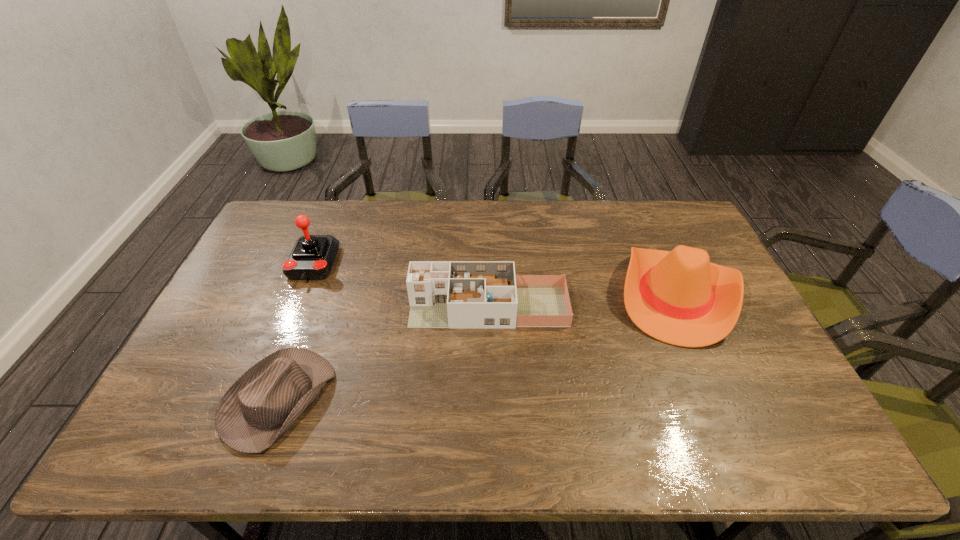
The height and width of the screenshot is (540, 960). Find the location of `joystick`. joystick is located at coordinates (312, 257).

You are a GUI agent. You are given a task and a screenshot of the screen. Output one action in this format:
    pyautogui.click(x=<x>, y=<y>)
    Task: Click on the rightmost object
    
    Given the screenshot: What is the action you would take?
    pyautogui.click(x=679, y=297)

Find the location of a particular element. This screenshot has height=540, width=960. the third object from left to right is located at coordinates (442, 294).

Identify the location of the nearest object. (264, 402).

I want to click on free space located on the base of the joystick, so click(277, 352).

Where is `free space located 0.310m on the left of the rightmost object`? This screenshot has width=960, height=540. free space located 0.310m on the left of the rightmost object is located at coordinates point(514,295).

At what (x,y) coordinates should I click in order to perform the action: click on blank area located at the entrance of the dollhouse. Please return your answer as a coordinate pair (x, y). Looking at the image, I should click on (360, 307).

In order to click on free space located at the entrance of the dollhouse in this screenshot , I will do `click(302, 307)`.

Locate an element on the screen. Image resolution: width=960 pixels, height=540 pixels. vacant position located at the entrance of the dollhouse is located at coordinates (306, 307).

In order to click on vacant space situated on the back of the nearest object in this screenshot , I will do `click(301, 337)`.